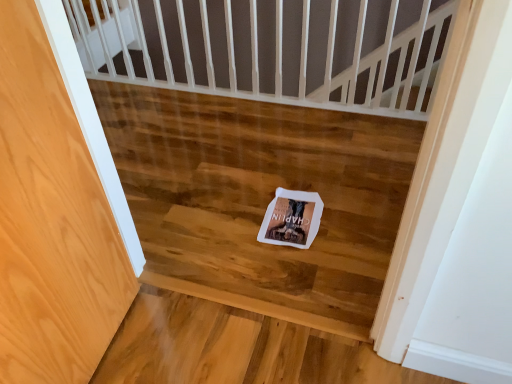
Find the location of a particular element. Image resolution: width=512 pixels, height=384 pixels. free location to the left of white paper postcard at center is located at coordinates (231, 217).